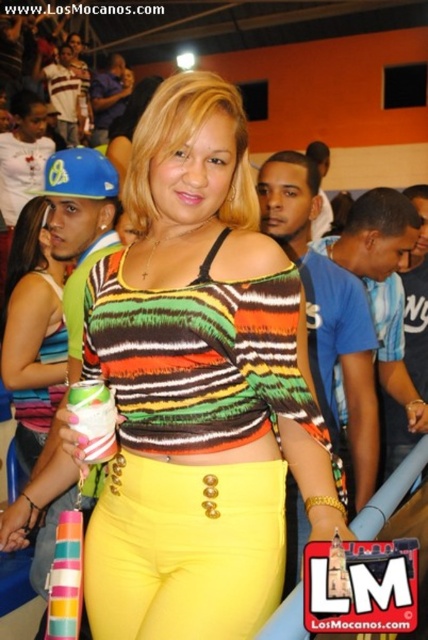
In the scene described, the woman is wearing a striped fabric top at center and yellow matte pants at center. From the perspective of someone facing her, which item is positioned to the right of the other?

The yellow matte pants at center are to the right of the striped fabric top at center.

You are a photographer trying to capture the woman in the center. Which item of clothing is positioned closer to the camera between the yellow matte pants at center and the striped fabric top at center?

The yellow matte pants at center are closer to the viewer than the striped fabric top at center, so the yellow matte pants at center would be the item closer to the camera.

You are a photographer at the event and want to focus on capturing the details of the two tops worn by the central figure. Which top should you adjust your camera focus on first to ensure clarity, the matte striped top at center or the striped fabric top at center?

The matte striped top at center is closer to the viewer than the striped fabric top at center, so you should focus on the matte striped top at center first to ensure clarity.